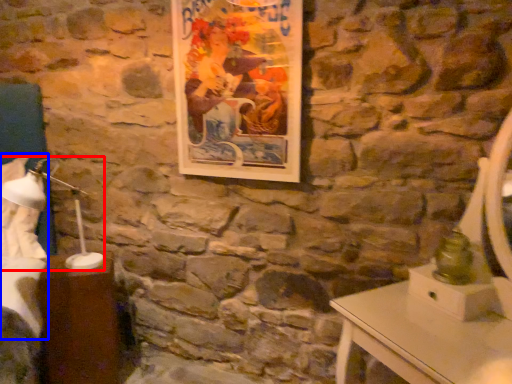
Question: Which of the following is the farthest to the observer, bedside lamp (highlighted by a red box) or sheet (highlighted by a blue box)?

Choices:
 (A) bedside lamp
 (B) sheet

Answer: (B)